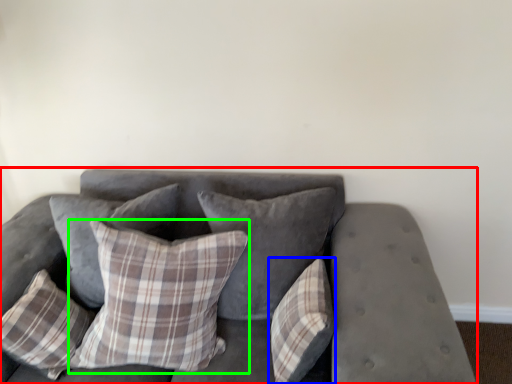
Question: Based on their relative distances, which object is farther from studio couch (highlighted by a red box)? Choose from pillow (highlighted by a blue box) and pillow (highlighted by a green box).

Choices:
 (A) pillow
 (B) pillow

Answer: (B)